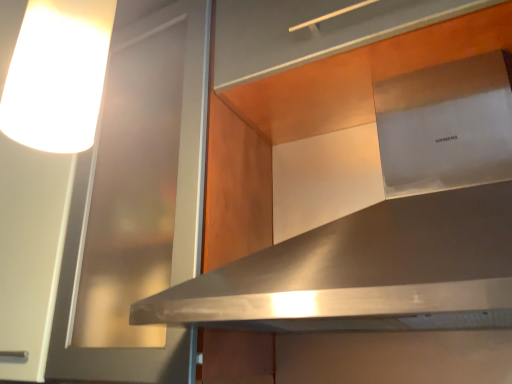
Describe the element at coordinates (182, 121) in the screenshot. This screenshot has height=384, width=512. I see `transparent glass door at upper center` at that location.

Where is `transparent glass door at upper center`? Image resolution: width=512 pixels, height=384 pixels. transparent glass door at upper center is located at coordinates (182, 121).

The width and height of the screenshot is (512, 384). What are the coordinates of `transparent glass door at upper center` in the screenshot? It's located at (182, 121).